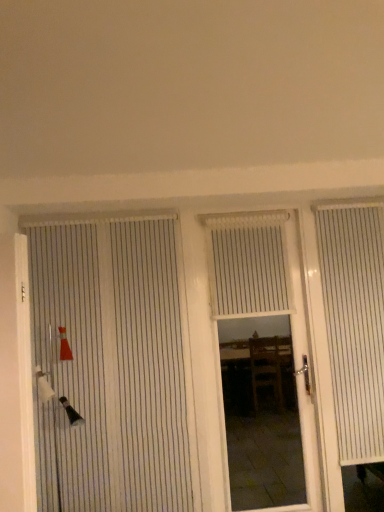
Question: Considering their positions, is white striped door at left, the 2th door from the right, located in front of or behind white textured blind at center?

Choices:
 (A) behind
 (B) front

Answer: (B)

Question: Is white striped door at left, the first door when ordered from left to right, to the left or to the right of white textured blind at center in the image?

Choices:
 (A) right
 (B) left

Answer: (B)

Question: Which object is positioned farthest from the white striped door at left, the 2th door from the right?

Choices:
 (A) white textured blind at center
 (B) white striped curtain at right
 (C) white wood door at center, arranged as the 2th door when viewed from the left

Answer: (C)

Question: Which is farther from the white wood door at center, arranged as the 2th door when viewed from the left?

Choices:
 (A) white striped curtain at right
 (B) white textured blind at center
 (C) white striped door at left, the 2th door from the right

Answer: (C)